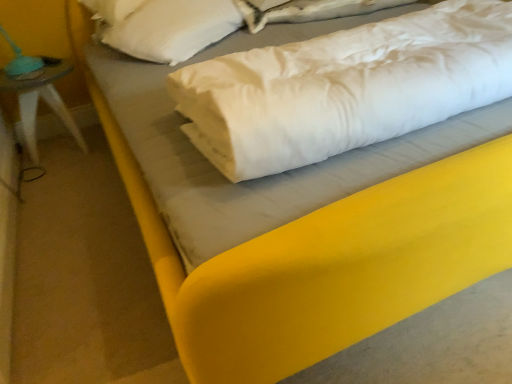
Question: Is white soft pillow at center positioned with its back to white soft pillow at upper left?

Choices:
 (A) no
 (B) yes

Answer: (B)

Question: Can you confirm if white soft pillow at center is shorter than white soft pillow at upper left?

Choices:
 (A) yes
 (B) no

Answer: (A)

Question: Is the surface of white soft pillow at center in direct contact with white soft pillow at upper left?

Choices:
 (A) no
 (B) yes

Answer: (A)

Question: Could you tell me if white soft pillow at center is turned towards white soft pillow at upper left?

Choices:
 (A) no
 (B) yes

Answer: (A)

Question: From the image's perspective, is white soft pillow at center above white soft pillow at upper left?

Choices:
 (A) yes
 (B) no

Answer: (B)

Question: Is white soft pillow at center thinner than white soft pillow at upper left?

Choices:
 (A) no
 (B) yes

Answer: (A)

Question: Does white soft pillow at center have a greater width compared to teal fabric lampshade at left?

Choices:
 (A) yes
 (B) no

Answer: (A)

Question: Is white soft pillow at center at the right side of teal fabric lampshade at left?

Choices:
 (A) no
 (B) yes

Answer: (B)

Question: Does white soft pillow at center have a larger size compared to teal fabric lampshade at left?

Choices:
 (A) no
 (B) yes

Answer: (B)

Question: Is teal fabric lampshade at left located within white soft pillow at center?

Choices:
 (A) no
 (B) yes

Answer: (A)

Question: Is white soft pillow at center located outside teal fabric lampshade at left?

Choices:
 (A) yes
 (B) no

Answer: (A)

Question: Is white soft pillow at center further to the viewer compared to teal fabric lampshade at left?

Choices:
 (A) no
 (B) yes

Answer: (A)

Question: Would you say white satin sheet at upper center is a long distance from teal fabric lampshade at left?

Choices:
 (A) yes
 (B) no

Answer: (A)